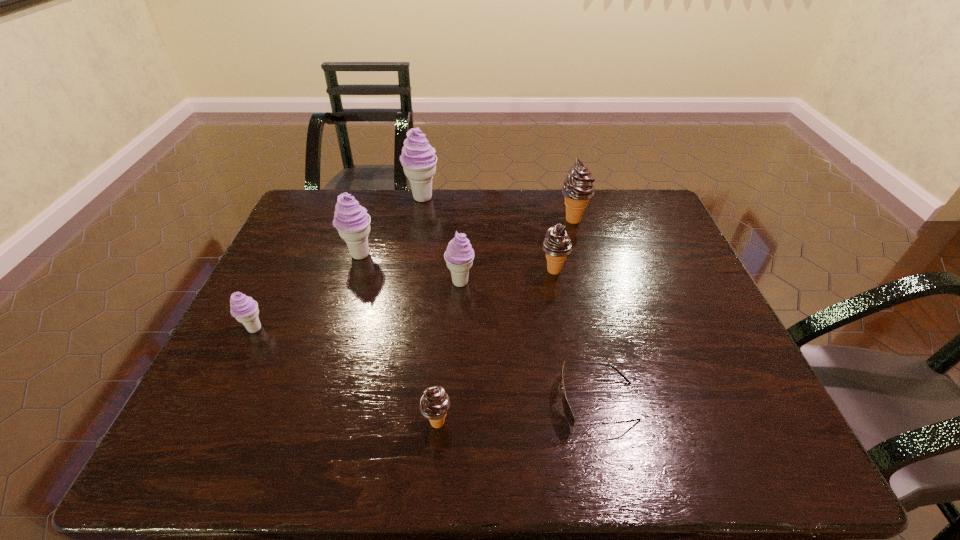
Identify which chocolate icecream is the closest to the rightmost chocolate icecream. Please provide its 2D coordinates. Your answer should be formatted as a tuple, i.e. [(x, y)], where the tuple contains the x and y coordinates of a point satisfying the conditions above.

[(557, 246)]

Identify the location of free location that satisfies the following two spatial constraints: 1. on the back side of the nearest icecream; 2. on the left side of the second farthest chocolate icecream. The height and width of the screenshot is (540, 960). click(448, 271).